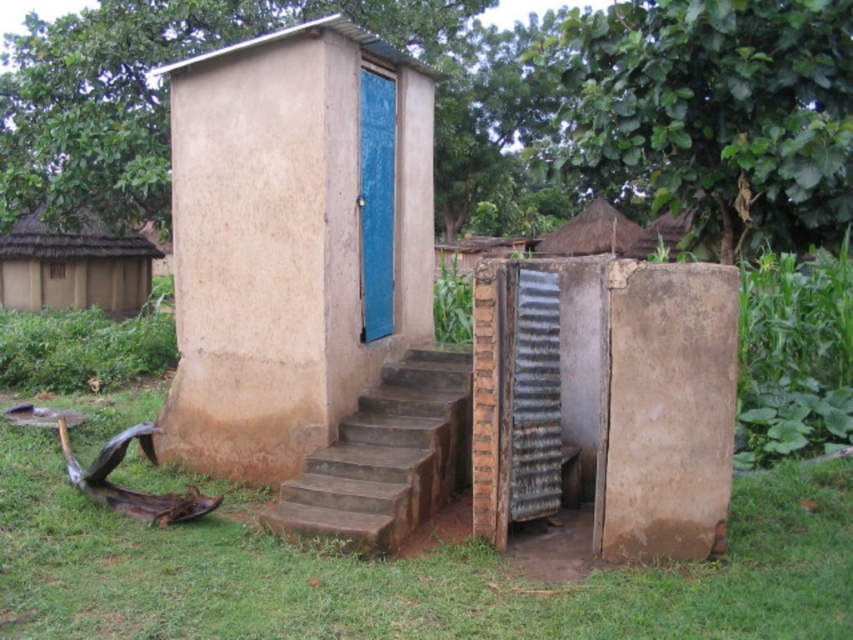
Does green grass at lower center have a lesser width compared to thatched roof hut at upper left?

No, green grass at lower center is not thinner than thatched roof hut at upper left.

Does green grass at lower center appear on the right side of thatched roof hut at upper left?

Indeed, green grass at lower center is positioned on the right side of thatched roof hut at upper left.

The height and width of the screenshot is (640, 853). In order to click on green grass at lower center in this screenshot , I will do `click(398, 570)`.

Between matte clay hut at center and brown concrete stairs at center, which one has less height?

With less height is brown concrete stairs at center.

Does matte clay hut at center come behind brown concrete stairs at center?

Yes, matte clay hut at center is further from the viewer.

Find the location of a particular element. matte clay hut at center is located at coordinates (293, 240).

Is brown concrete stairs at center to the right of blue textured door at center from the viewer's perspective?

Indeed, brown concrete stairs at center is positioned on the right side of blue textured door at center.

Does point (328, 520) come behind point (368, 112)?

No, (328, 520) is closer to viewer.

Where is `brown concrete stairs at center`? The height and width of the screenshot is (640, 853). brown concrete stairs at center is located at coordinates (386, 458).